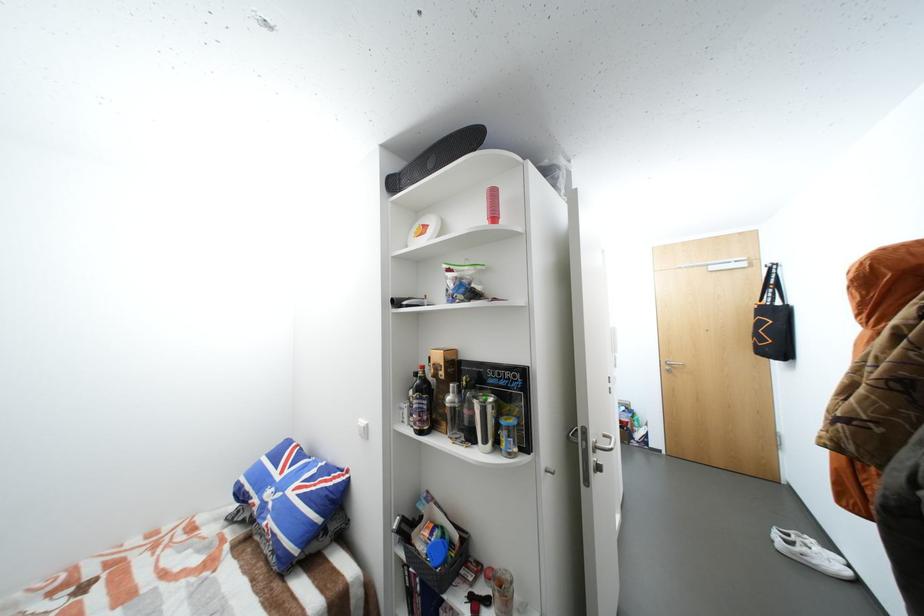
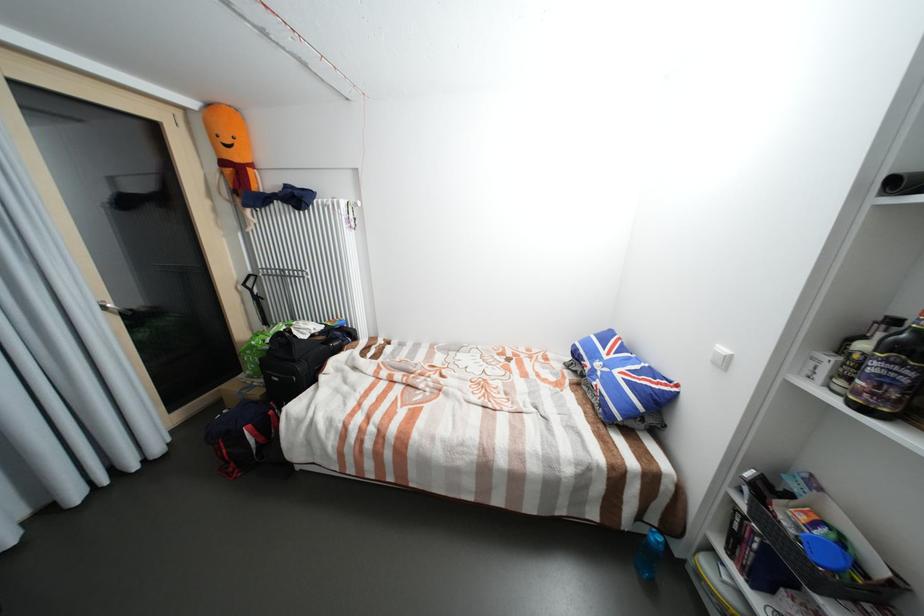
Locate, in the second image, the point that corresponds to (x=286, y=479) in the first image.

(613, 358)